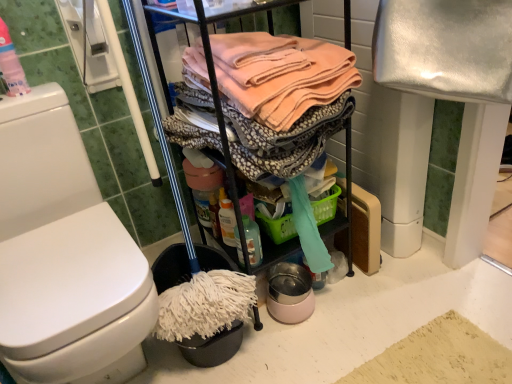
In order to click on translucent plastic spray bottle at lower center, the 2th cleaning products in the left-to-right sequence in this screenshot , I will do `click(252, 240)`.

I want to click on white glossy toilet at left, so click(x=64, y=255).

This screenshot has width=512, height=384. What are the coordinates of `soft peach fabric at center` in the screenshot? It's located at (269, 102).

Can you confirm if white glossy toilet at left is taller than translucent plastic spray bottle at lower center, the first cleaning products positioned from the bottom?

Correct, white glossy toilet at left is much taller as translucent plastic spray bottle at lower center, the first cleaning products positioned from the bottom.

From a real-world perspective, relative to translucent plastic spray bottle at lower center, the first cleaning products positioned from the bottom, is white glossy toilet at left vertically above or below?

Clearly, from a real-world perspective, white glossy toilet at left is above translucent plastic spray bottle at lower center, the first cleaning products positioned from the bottom.

Does white glossy toilet at left have a greater width compared to translucent plastic spray bottle at lower center, the first cleaning products positioned from the bottom?

Yes.

Is translucent plastic bottle at upper left, the first cleaning products from the left, at the back of white glossy toilet at left?

No, white glossy toilet at left is not facing the opposite direction of translucent plastic bottle at upper left, the first cleaning products from the left.

Measure the distance from white glossy toilet at left to translucent plastic bottle at upper left, the first cleaning products from the left.

15.81 inches.

Between white glossy toilet at left and translucent plastic bottle at upper left, the 1th cleaning products positioned from the top, which one has larger size?

white glossy toilet at left.

From the image's perspective, does white glossy toilet at left appear lower than translucent plastic bottle at upper left, the 1th cleaning products positioned from the top?

Yes.

Identify the location of the 1st cleaning products behind the soft peach fabric at center. Image resolution: width=512 pixels, height=384 pixels. (11, 65).

Consider the image. Is soft peach fabric at center aimed at translucent plastic bottle at upper left, the first cleaning products from the left?

No.

Measure the distance from soft peach fabric at center to translucent plastic bottle at upper left, which appears as the second cleaning products when viewed from the right.

soft peach fabric at center and translucent plastic bottle at upper left, which appears as the second cleaning products when viewed from the right, are 24.52 inches apart.

Which is more to the right, soft peach fabric at center or translucent plastic bottle at upper left, which appears as the 2th cleaning products when viewed from the back?

soft peach fabric at center is more to the right.

Between translucent plastic spray bottle at lower center, which appears as the 2th cleaning products when viewed from the top, and translucent plastic bottle at upper left, which is the 2th cleaning products in bottom-to-top order, which one has larger width?

translucent plastic spray bottle at lower center, which appears as the 2th cleaning products when viewed from the top.

Is translucent plastic spray bottle at lower center, the 1th cleaning products from the right, with translucent plastic bottle at upper left, the first cleaning products from the left?

No, translucent plastic spray bottle at lower center, the 1th cleaning products from the right, is not making contact with translucent plastic bottle at upper left, the first cleaning products from the left.

Is translucent plastic bottle at upper left, the first cleaning products from the left, completely or partially inside translucent plastic spray bottle at lower center, the 2th cleaning products in the left-to-right sequence?

No, translucent plastic bottle at upper left, the first cleaning products from the left, is not inside translucent plastic spray bottle at lower center, the 2th cleaning products in the left-to-right sequence.

Is translucent plastic bottle at upper left, which is the 2th cleaning products in bottom-to-top order, looking in the opposite direction of white glossy toilet at left?

No, translucent plastic bottle at upper left, which is the 2th cleaning products in bottom-to-top order, is not facing away from white glossy toilet at left.

There is a white glossy toilet at left. At what (x,y) coordinates should I click in order to perform the action: click on the 2nd cleaning products above it (from the image's perspective). Please return your answer as a coordinate pair (x, y). Looking at the image, I should click on (11, 65).

Are translucent plastic bottle at upper left, the first cleaning products from the left, and white glossy toilet at left located far from each other?

No.

How different are the orientations of translucent plastic bottle at upper left, which appears as the 2th cleaning products when viewed from the back, and white glossy toilet at left in degrees?

There is a 1.56-degree angle between the facing directions of translucent plastic bottle at upper left, which appears as the 2th cleaning products when viewed from the back, and white glossy toilet at left.

Is translucent plastic spray bottle at lower center, the 2th cleaning products in the left-to-right sequence, positioned beyond the bounds of soft peach fabric at center?

Indeed, translucent plastic spray bottle at lower center, the 2th cleaning products in the left-to-right sequence, is completely outside soft peach fabric at center.

Is translucent plastic spray bottle at lower center, the 2th cleaning products in the left-to-right sequence, in front of or behind soft peach fabric at center in the image?

translucent plastic spray bottle at lower center, the 2th cleaning products in the left-to-right sequence, is positioned farther from the viewer than soft peach fabric at center.

Does translucent plastic spray bottle at lower center, which ranks as the second cleaning products in front-to-back order, have a lesser width compared to soft peach fabric at center?

Indeed, translucent plastic spray bottle at lower center, which ranks as the second cleaning products in front-to-back order, has a lesser width compared to soft peach fabric at center.

How much distance is there between translucent plastic bottle at upper left, which appears as the 2th cleaning products when viewed from the back, and soft peach fabric at center?

24.52 inches.

Considering the sizes of objects translucent plastic bottle at upper left, the first cleaning products from the left, and soft peach fabric at center in the image provided, who is shorter, translucent plastic bottle at upper left, the first cleaning products from the left, or soft peach fabric at center?

translucent plastic bottle at upper left, the first cleaning products from the left, is shorter.

From a real-world perspective, between translucent plastic bottle at upper left, which appears as the 2th cleaning products when viewed from the back, and soft peach fabric at center, who is vertically higher?

In real-world perspective, translucent plastic bottle at upper left, which appears as the 2th cleaning products when viewed from the back, is above.

Are translucent plastic bottle at upper left, the first cleaning products from the left, and soft peach fabric at center located far from each other?

No, translucent plastic bottle at upper left, the first cleaning products from the left, is not far from soft peach fabric at center.

Image resolution: width=512 pixels, height=384 pixels. I want to click on cleaning products lying on the right of white glossy toilet at left, so click(252, 240).

Where is `the 1st cleaning products behind when counting from the white glossy toilet at left`? The image size is (512, 384). the 1st cleaning products behind when counting from the white glossy toilet at left is located at coordinates (11, 65).

Looking at the image, which one is located closer to white glossy toilet at left, translucent plastic bottle at upper left, which appears as the 2th cleaning products when viewed from the back, or translucent plastic spray bottle at lower center, the 2th cleaning products in the left-to-right sequence?

The object closer to white glossy toilet at left is translucent plastic bottle at upper left, which appears as the 2th cleaning products when viewed from the back.

Looking at the image, which one is located further to translucent plastic bottle at upper left, the 1th cleaning products positioned from the top, translucent plastic spray bottle at lower center, which is counted as the 1th cleaning products, starting from the back, or white glossy toilet at left?

The object further to translucent plastic bottle at upper left, the 1th cleaning products positioned from the top, is translucent plastic spray bottle at lower center, which is counted as the 1th cleaning products, starting from the back.

Estimate the real-world distances between objects in this image. Which object is closer to white glossy toilet at left, soft peach fabric at center or translucent plastic bottle at upper left, which is the 2th cleaning products in bottom-to-top order?

The object closer to white glossy toilet at left is translucent plastic bottle at upper left, which is the 2th cleaning products in bottom-to-top order.

Based on their spatial positions, is soft peach fabric at center or translucent plastic bottle at upper left, which is the 2th cleaning products in bottom-to-top order, further from translucent plastic spray bottle at lower center, which appears as the 2th cleaning products when viewed from the top?

translucent plastic bottle at upper left, which is the 2th cleaning products in bottom-to-top order.

Looking at the image, which one is located closer to translucent plastic bottle at upper left, the 1th cleaning products positioned from the top, soft peach fabric at center or translucent plastic spray bottle at lower center, which appears as the 2th cleaning products when viewed from the top?

soft peach fabric at center is closer to translucent plastic bottle at upper left, the 1th cleaning products positioned from the top.

Looking at the image, which one is located closer to translucent plastic bottle at upper left, the 1th cleaning products positioned from the top, translucent plastic spray bottle at lower center, the 2th cleaning products in the left-to-right sequence, or soft peach fabric at center?

soft peach fabric at center.

Considering their positions, is white glossy toilet at left positioned closer to soft peach fabric at center than translucent plastic spray bottle at lower center, the 2th cleaning products in the left-to-right sequence?

The object closer to soft peach fabric at center is translucent plastic spray bottle at lower center, the 2th cleaning products in the left-to-right sequence.

Looking at the image, which one is located further to white glossy toilet at left, translucent plastic spray bottle at lower center, which is counted as the 1th cleaning products, starting from the back, or translucent plastic bottle at upper left, the first cleaning products from the left?

The object further to white glossy toilet at left is translucent plastic spray bottle at lower center, which is counted as the 1th cleaning products, starting from the back.

Identify the location of toilet situated between translucent plastic bottle at upper left, which is the 2th cleaning products in bottom-to-top order, and soft peach fabric at center from left to right. (64, 255).

Where is `toilet between translucent plastic bottle at upper left, which is the 2th cleaning products in bottom-to-top order, and translucent plastic spray bottle at lower center, the 1th cleaning products from the right, in the horizontal direction`? toilet between translucent plastic bottle at upper left, which is the 2th cleaning products in bottom-to-top order, and translucent plastic spray bottle at lower center, the 1th cleaning products from the right, in the horizontal direction is located at coordinates (64, 255).

Find the location of a particular element. The image size is (512, 384). cleaning products between white glossy toilet at left and soft peach fabric at center from left to right is located at coordinates (252, 240).

Find the location of `cleaning products between translucent plastic bottle at upper left, the 1th cleaning products positioned from the top, and soft peach fabric at center from left to right`. cleaning products between translucent plastic bottle at upper left, the 1th cleaning products positioned from the top, and soft peach fabric at center from left to right is located at coordinates (252, 240).